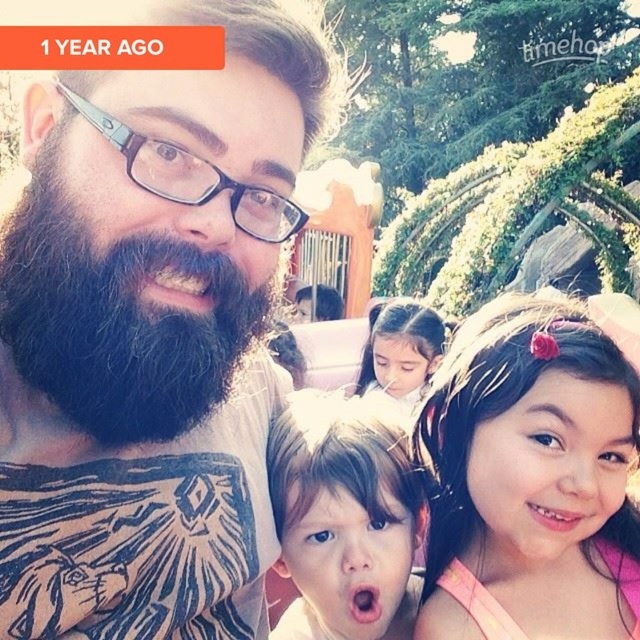
Question: Which point is closer to the camera?

Choices:
 (A) (280, 620)
 (B) (426, 636)

Answer: (B)

Question: Can you confirm if blackwoody/blackbeard at left is wider than smooth skin face at center?

Choices:
 (A) yes
 (B) no

Answer: (A)

Question: Is blackwoody/blackbeard at left to the left of smooth skin face at center from the viewer's perspective?

Choices:
 (A) no
 (B) yes

Answer: (B)

Question: Can you confirm if smooth skin face at center is thinner than smooth skin girl at center?

Choices:
 (A) no
 (B) yes

Answer: (B)

Question: Which object is positioned farthest from the blackwoody/blackbeard at left?

Choices:
 (A) smooth skin girl at center
 (B) pink fabric at right
 (C) smooth skin face at center
 (D) dark brown beard at center

Answer: (A)

Question: Which point is closer to the camera taking this photo?

Choices:
 (A) (54, 193)
 (B) (272, 477)
 (C) (499, 422)

Answer: (A)